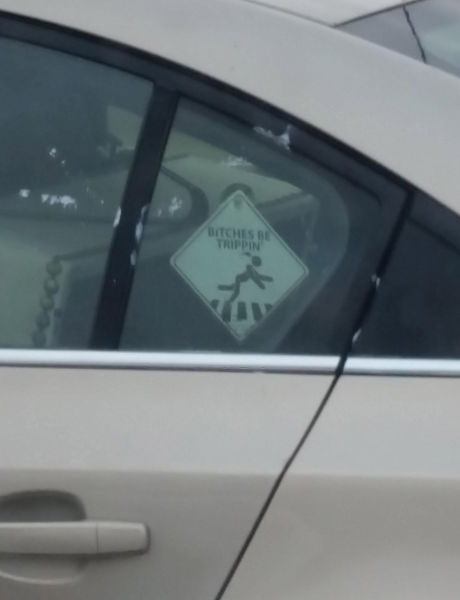
This screenshot has height=600, width=460. In order to click on window in this screenshot , I will do pyautogui.click(x=51, y=259), pyautogui.click(x=309, y=196).